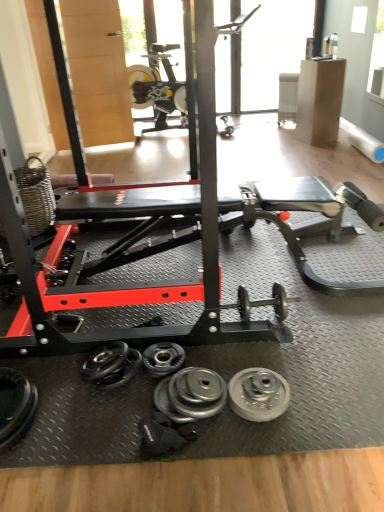
The width and height of the screenshot is (384, 512). What are the coordinates of `empty space that is ontop of silver metallic dumbbell at center, acting as the third dumbbell starting from the left (from a real-world perspective)` in the screenshot? It's located at (195, 390).